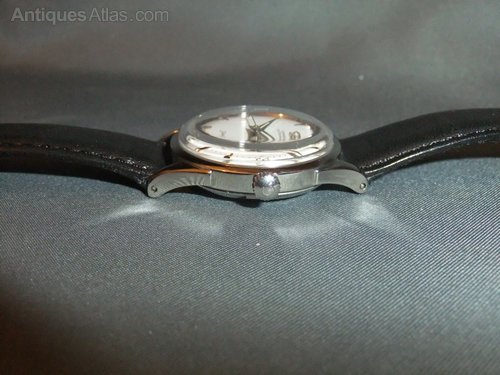
Image resolution: width=500 pixels, height=375 pixels. I want to click on glass, so click(x=263, y=126).